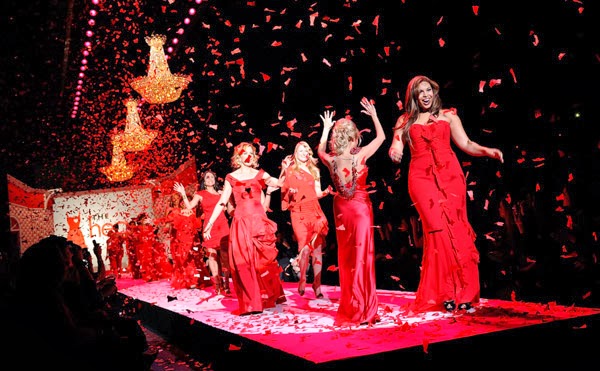
I want to click on three chandelier, so click(160, 83), click(126, 131), click(104, 168).